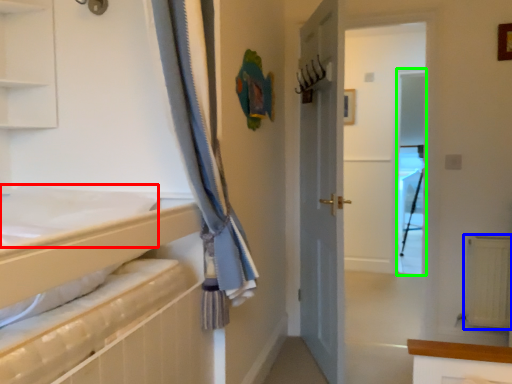
Question: Based on their relative distances, which object is nearer to sheet (highlighted by a red box)? Choose from radiator (highlighted by a blue box) and screen door (highlighted by a green box).

Choices:
 (A) radiator
 (B) screen door

Answer: (A)